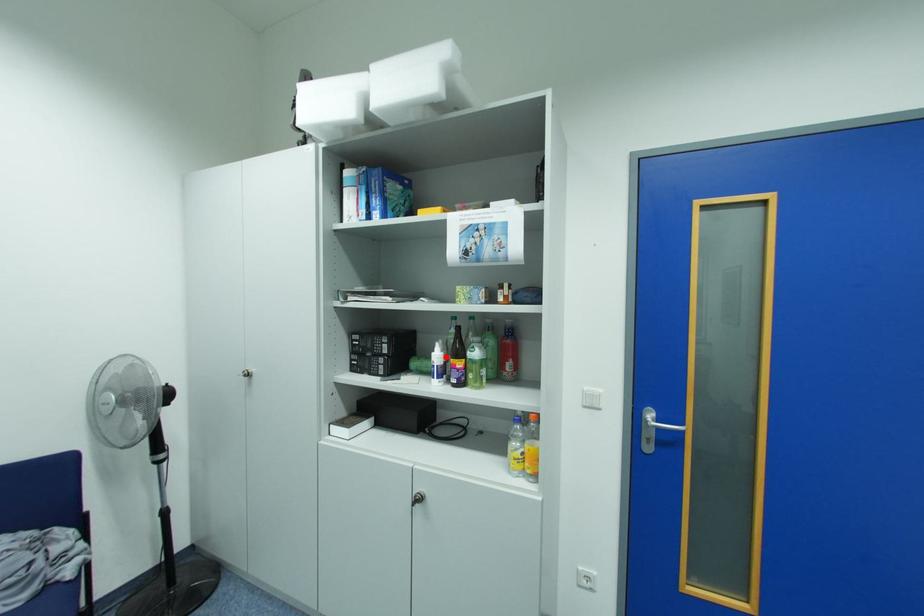
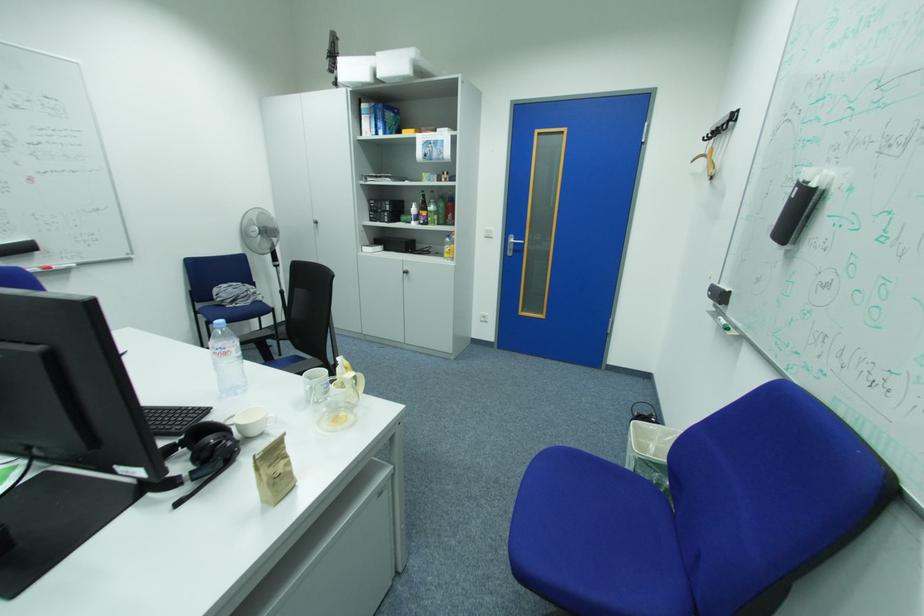
Locate, in the second image, the point that corresponds to the highlighted location in the first image.

(422, 211)